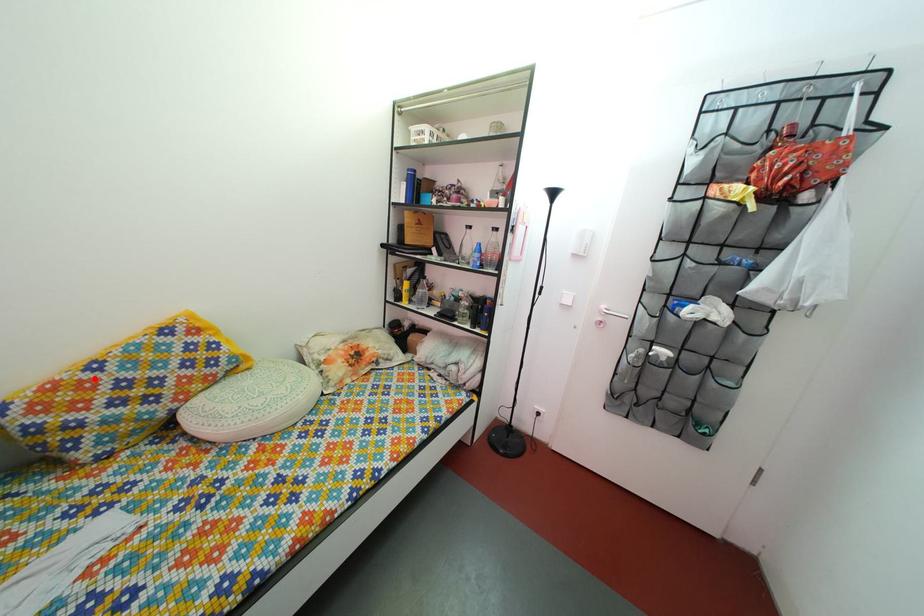
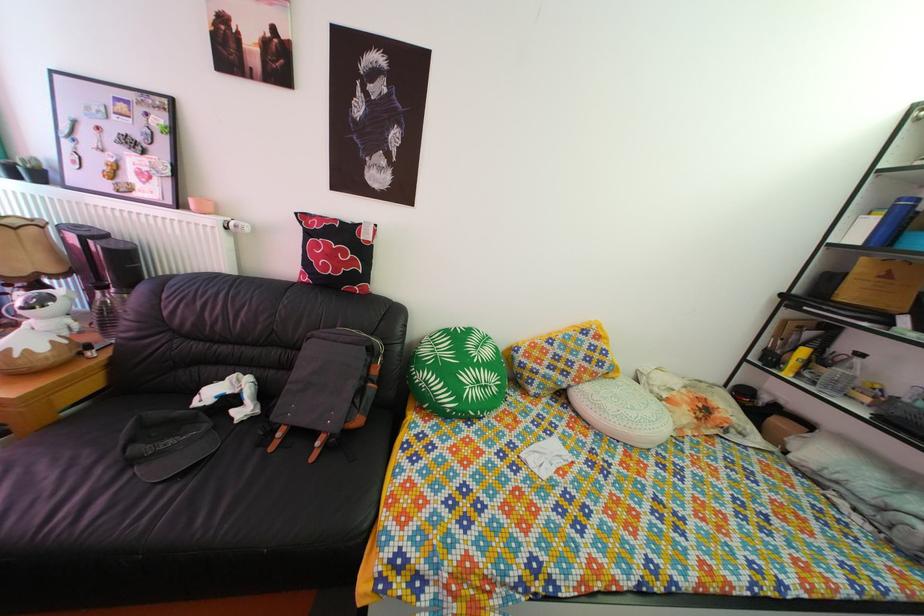
Where in the second image is the point corresponding to the highlighted location from the first image?

(555, 351)